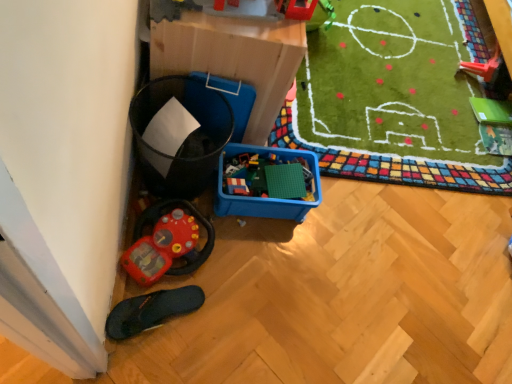
Question: From the image's perspective, is rubberized plastic toy at upper center, which is counted as the second toy, starting from the right, located beneath rubberized red toy car at lower left, the first toy from the left?

Choices:
 (A) yes
 (B) no

Answer: (B)

Question: Is rubberized plastic toy at upper center, positioned as the 3th toy in back-to-front order, surrounding rubberized red toy car at lower left, the first toy from the left?

Choices:
 (A) no
 (B) yes

Answer: (A)

Question: Could you tell me if rubberized plastic toy at upper center, positioned as the 3th toy in back-to-front order, is facing rubberized red toy car at lower left, which is counted as the 2th toy, starting from the back?

Choices:
 (A) no
 (B) yes

Answer: (A)

Question: Is the position of rubberized plastic toy at upper center, which is the 2th toy in top-to-bottom order, less distant than that of rubberized red toy car at lower left, which appears as the first toy when ordered from the bottom?

Choices:
 (A) no
 (B) yes

Answer: (B)

Question: From a real-world perspective, is rubberized plastic toy at upper center, positioned as the 3th toy in back-to-front order, over rubberized red toy car at lower left, which appears as the first toy when ordered from the bottom?

Choices:
 (A) yes
 (B) no

Answer: (A)

Question: Is rubberized plastic toy at upper center, which is the 2th toy in top-to-bottom order, outside rubberized red toy car at lower left, which appears as the first toy when ordered from the bottom?

Choices:
 (A) yes
 (B) no

Answer: (A)

Question: Is the depth of blue plastic storage box at lower left greater than that of black rubber slipper at lower left?

Choices:
 (A) yes
 (B) no

Answer: (B)

Question: Could you tell me if blue plastic storage box at lower left is turned towards black rubber slipper at lower left?

Choices:
 (A) yes
 (B) no

Answer: (B)

Question: Considering the relative sizes of blue plastic storage box at lower left and black rubber slipper at lower left in the image provided, is blue plastic storage box at lower left smaller than black rubber slipper at lower left?

Choices:
 (A) yes
 (B) no

Answer: (B)

Question: Can you confirm if blue plastic storage box at lower left is wider than black rubber slipper at lower left?

Choices:
 (A) yes
 (B) no

Answer: (A)

Question: From the image's perspective, would you say blue plastic storage box at lower left is positioned over black rubber slipper at lower left?

Choices:
 (A) yes
 (B) no

Answer: (A)

Question: From a real-world perspective, is blue plastic storage box at lower left below black rubber slipper at lower left?

Choices:
 (A) no
 (B) yes

Answer: (A)

Question: Is black rubber slipper at lower left positioned beyond the bounds of rubberized plastic toy at upper right, arranged as the 1th toy when viewed from the back?

Choices:
 (A) no
 (B) yes

Answer: (B)